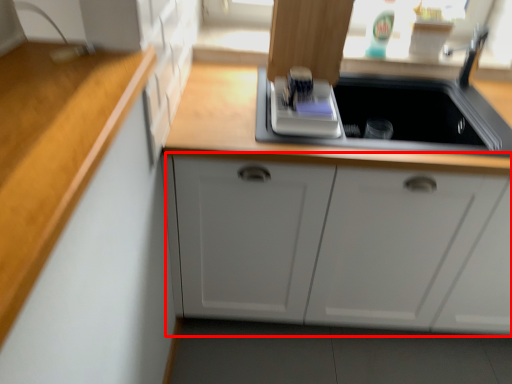
Question: From the image's perspective, where is cabinetry (annotated by the red box) located relative to appliance?

Choices:
 (A) above
 (B) below

Answer: (B)